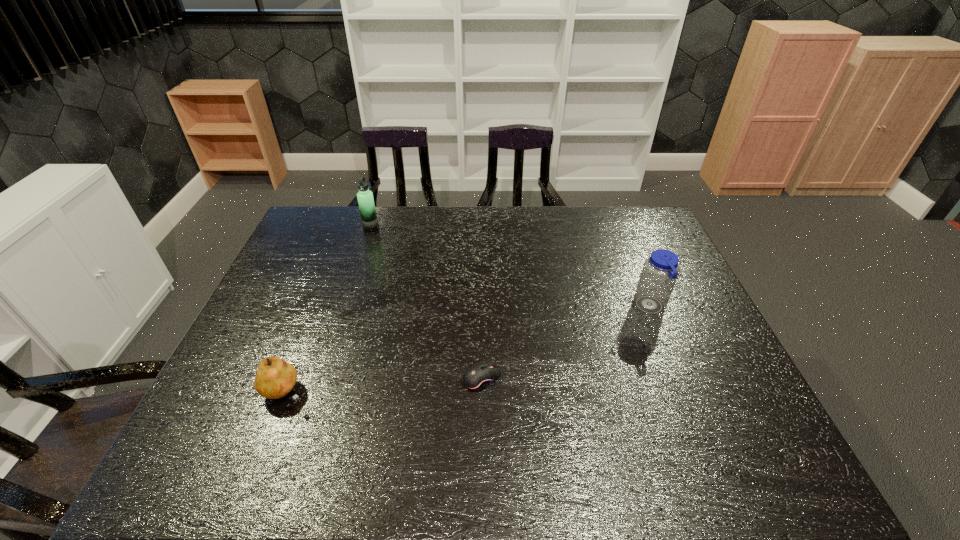
Find the location of a particular element. The width and height of the screenshot is (960, 540). object that can be found as the third closest to the water bottle is located at coordinates (275, 378).

Locate an element on the screen. The height and width of the screenshot is (540, 960). object identified as the closest to the third nearest object is located at coordinates (478, 377).

I want to click on free space that satisfies the following two spatial constraints: 1. on the back side of the third tallest object; 2. on the right side of the second object from right to left, so click(x=291, y=378).

This screenshot has width=960, height=540. Identify the location of free location that satisfies the following two spatial constraints: 1. with a carrying loop on the side of the second farthest object; 2. on the front side of the pear. (685, 393).